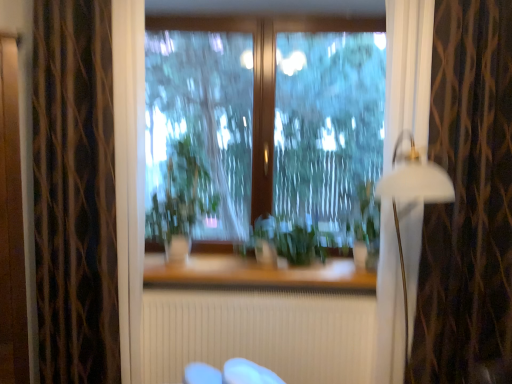
Where is `free space above transparent glass window at center (from a real-world perspective)`? The image size is (512, 384). free space above transparent glass window at center (from a real-world perspective) is located at coordinates (279, 7).